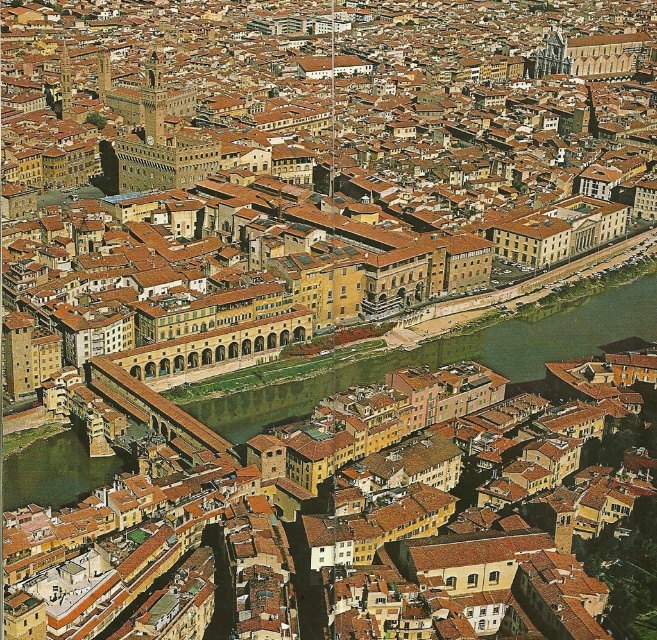
In the scene shown: Between matte yellow building at center and matte stone bridge at center, which one is positioned lower?

Positioned lower is matte stone bridge at center.

Does matte yellow building at center have a greater width compared to matte stone bridge at center?

Correct, the width of matte yellow building at center exceeds that of matte stone bridge at center.

Between point (160, 193) and point (539, 358), which one is positioned in front?

Point (539, 358) is more forward.

I want to click on matte yellow building at center, so click(309, 161).

Is matte yellow building at center positioned behind green water at center?

Yes.

Describe the element at coordinates (309, 161) in the screenshot. I see `matte yellow building at center` at that location.

At what (x,y) coordinates should I click in order to perform the action: click on matte yellow building at center. Please return your answer as a coordinate pair (x, y). Looking at the image, I should click on (309, 161).

Between green water at center and matte stone bridge at center, which one appears on the right side from the viewer's perspective?

green water at center is more to the right.

In the scene shown: Is green water at center in front of matte stone bridge at center?

No, it is behind matte stone bridge at center.

This screenshot has height=640, width=657. What do you see at coordinates (453, 356) in the screenshot?
I see `green water at center` at bounding box center [453, 356].

I want to click on green water at center, so click(x=453, y=356).